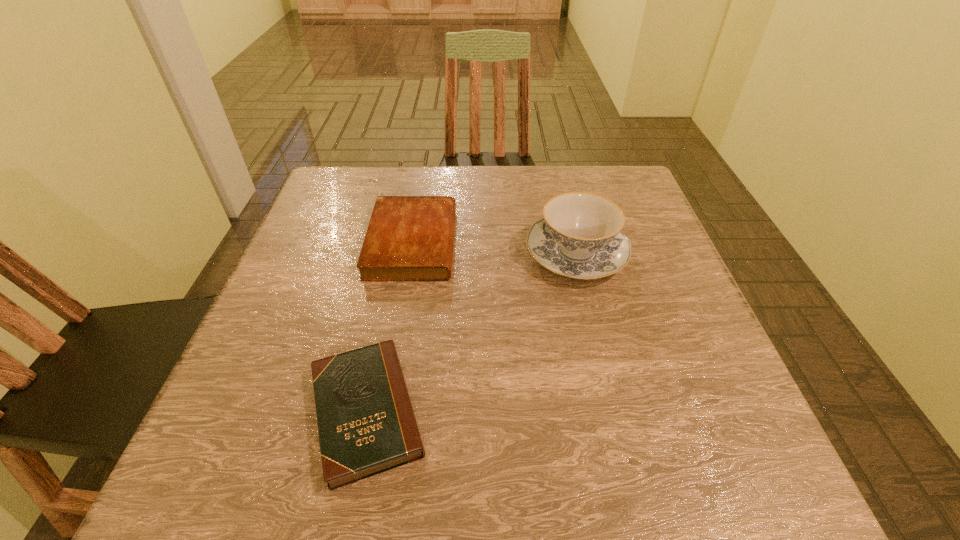
Image resolution: width=960 pixels, height=540 pixels. Find the location of `chinaware`. chinaware is located at coordinates (580, 236).

What are the coordinates of `the tallest object` in the screenshot? It's located at (580, 236).

Locate an element on the screen. The height and width of the screenshot is (540, 960). the second tallest object is located at coordinates (409, 238).

This screenshot has width=960, height=540. What are the coordinates of `the farther Bible` in the screenshot? It's located at (409, 238).

Locate an element on the screen. The image size is (960, 540). the shorter Bible is located at coordinates (366, 424).

Identify the location of the shortest object. The image size is (960, 540). (366, 424).

In order to click on vacant space situated 0.190m with the handle on the side of the chinaware in this screenshot , I will do `click(558, 179)`.

This screenshot has width=960, height=540. I want to click on vacant space located 0.190m with the handle on the side of the chinaware, so click(x=558, y=179).

Locate an element on the screen. The height and width of the screenshot is (540, 960). vacant space located 0.210m with the handle on the side of the chinaware is located at coordinates (557, 175).

Locate an element on the screen. This screenshot has height=540, width=960. vacant region located on the spine side of the taller Bible is located at coordinates (503, 243).